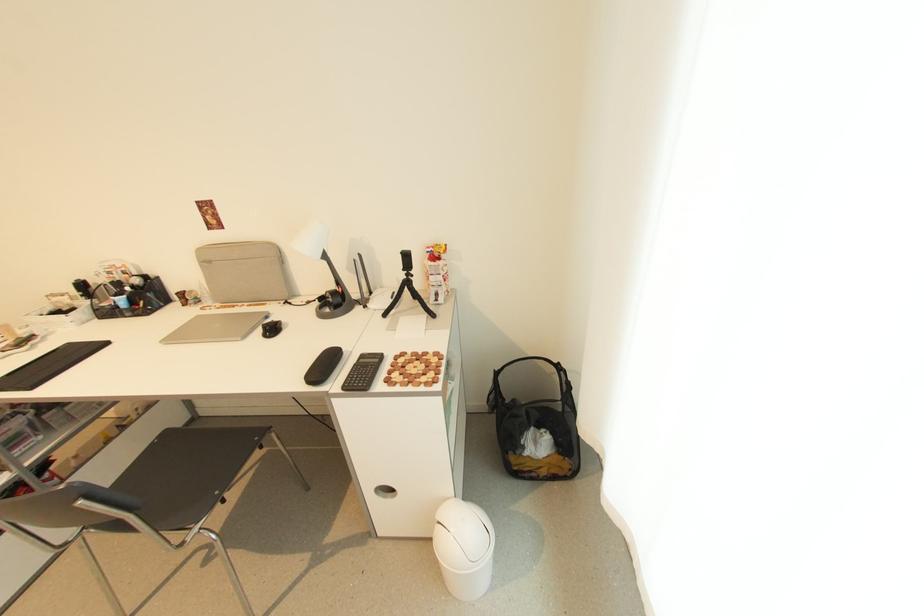
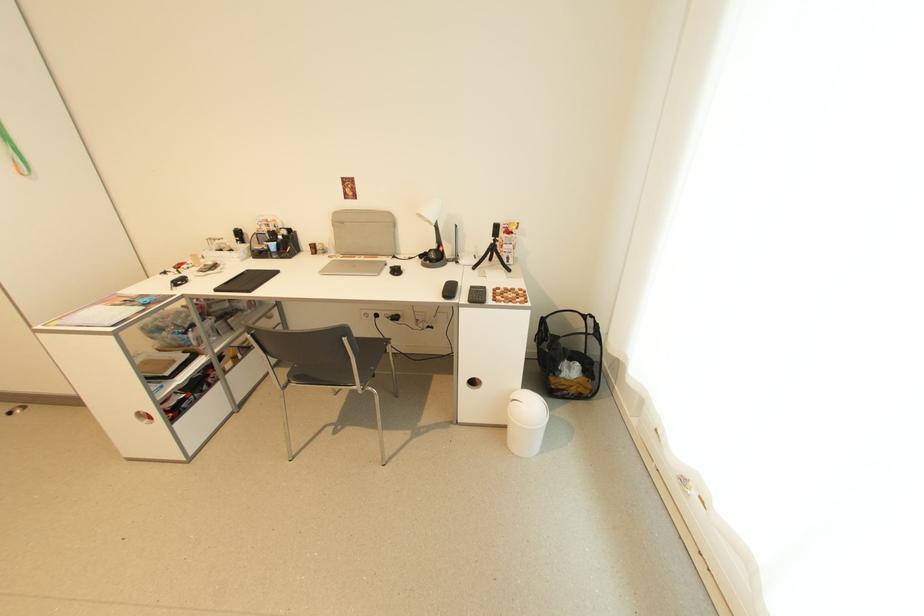
Where in the second image is the point corresponding to point 336,288 from the first image?

(439, 248)